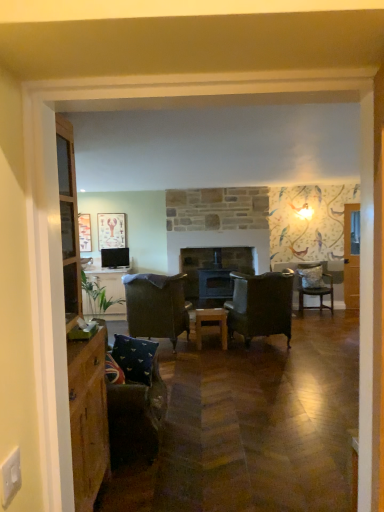
Question: In terms of size, does velvet dark brown armchair at center, acting as the second chair starting from the back, appear bigger or smaller than wooden picture frame at left, which is counted as the first picture frame, starting from the left?

Choices:
 (A) small
 (B) big

Answer: (B)

Question: Is velvet dark brown armchair at center, the first chair positioned from the left, inside the boundaries of wooden picture frame at left, the second picture frame in the right-to-left sequence, or outside?

Choices:
 (A) outside
 (B) inside

Answer: (A)

Question: Which object is the closest to the wooden table at center?

Choices:
 (A) wooden picture frame at left, which is counted as the first picture frame, starting from the left
 (B) velvet dark brown chair at right, the 3th chair when ordered from front to back
 (C) leather armchair at center, the second chair when ordered from right to left
 (D) wooden stove at center
 (E) matte wooden picture frame at upper left, acting as the first picture frame starting from the right

Answer: (C)

Question: Which is nearer to the matte wooden picture frame at upper left, the second picture frame in the left-to-right sequence?

Choices:
 (A) matte black television at upper left
 (B) leather armchair at center, which is counted as the third chair, starting from the back
 (C) blue fabric pillow at lower left
 (D) velvet dark brown chair at right, acting as the third chair starting from the left
 (E) wooden picture frame at left, which is counted as the first picture frame, starting from the left

Answer: (A)